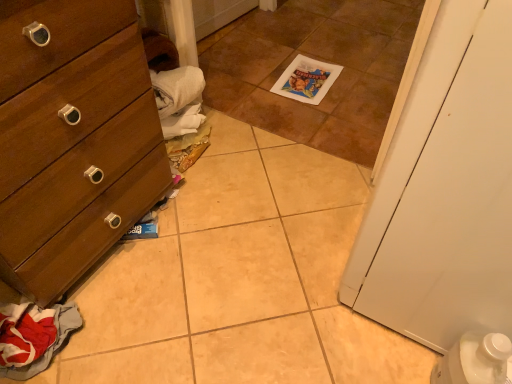
The height and width of the screenshot is (384, 512). Find the location of `red fabric clothes at lower left`. red fabric clothes at lower left is located at coordinates (52, 345).

What is the approximate width of wooden dresser at left?

It is 15.90 inches.

You are a GUI agent. You are given a task and a screenshot of the screen. Output one action in this format:
    pyautogui.click(x=<x>, y=<y>)
    Task: Click on the white matte door at right
    
    Given the screenshot: What is the action you would take?
    pyautogui.click(x=454, y=206)

Can you confirm if red fabric clothes at lower left is thinner than white matte door at right?

Yes, red fabric clothes at lower left is thinner than white matte door at right.

Could you tell me if red fabric clothes at lower left is facing white matte door at right?

No.

Looking at this image, would you say white matte door at right is part of red fabric clothes at lower left's contents?

Actually, white matte door at right is outside red fabric clothes at lower left.

Between red fabric clothes at lower left and white matte door at right, which one has larger size?

With larger size is white matte door at right.

Is white matte door at right to the left of brown tile at center from the viewer's perspective?

No, white matte door at right is not to the left of brown tile at center.

From a real-world perspective, is white matte door at right beneath brown tile at center?

No, from a real-world perspective, white matte door at right is not beneath brown tile at center.

Find the location of a particular element. tile on the left of white matte door at right is located at coordinates tap(317, 59).

Would you say white matte door at right is a long distance from brown tile at center?

Absolutely, white matte door at right is distant from brown tile at center.

Between white matte door at right and wooden dresser at left, which one has smaller size?

With smaller size is white matte door at right.

Is white matte door at right wider than wooden dresser at left?

Yes, white matte door at right is wider than wooden dresser at left.

Does white matte door at right turn towards wooden dresser at left?

Yes, white matte door at right is aimed at wooden dresser at left.

Looking at this image, do you think white matte door at right is within wooden dresser at left, or outside of it?

white matte door at right is spatially situated outside wooden dresser at left.

From the image's perspective, is wooden dresser at left over red fabric clothes at lower left?

Correct, wooden dresser at left appears higher than red fabric clothes at lower left in the image.

Is wooden dresser at left directly adjacent to red fabric clothes at lower left?

No, wooden dresser at left is not touching red fabric clothes at lower left.

Is wooden dresser at left oriented towards red fabric clothes at lower left?

No, wooden dresser at left is not oriented towards red fabric clothes at lower left.

Considering the points (26, 164) and (68, 318), which point is behind, point (26, 164) or point (68, 318)?

Point (68, 318)

Which object is positioned more to the left, brown tile at center or red fabric clothes at lower left?

red fabric clothes at lower left.

Is point (352, 11) positioned behind point (57, 317)?

Yes, point (352, 11) is behind point (57, 317).

Considering the sizes of objects brown tile at center and red fabric clothes at lower left in the image provided, who is taller, brown tile at center or red fabric clothes at lower left?

Standing taller between the two is red fabric clothes at lower left.

Is brown tile at center in front of or behind red fabric clothes at lower left in the image?

Visually, brown tile at center is located behind red fabric clothes at lower left.

Is the position of wooden dresser at left more distant than that of brown tile at center?

No, the depth of wooden dresser at left is less than that of brown tile at center.

How many degrees apart are the facing directions of wooden dresser at left and brown tile at center?

The angular difference between wooden dresser at left and brown tile at center is 179 degrees.

From a real-world perspective, is wooden dresser at left under brown tile at center?

No.

Can you confirm if wooden dresser at left is taller than brown tile at center?

Indeed, wooden dresser at left has a greater height compared to brown tile at center.

Between brown tile at center and white matte door at right, which one appears on the right side from the viewer's perspective?

white matte door at right is more to the right.

Consider the image. Is brown tile at center aimed at white matte door at right?

No, brown tile at center is not aimed at white matte door at right.

Where is `door in front of the brown tile at center`? door in front of the brown tile at center is located at coordinates (454, 206).

In terms of width, does brown tile at center look wider or thinner when compared to white matte door at right?

Considering their sizes, brown tile at center looks broader than white matte door at right.

The height and width of the screenshot is (384, 512). I want to click on door above the red fabric clothes at lower left (from a real-world perspective), so click(x=454, y=206).

This screenshot has height=384, width=512. I want to click on door below the brown tile at center (from the image's perspective), so click(x=454, y=206).

Which object lies further to the anchor point brown tile at center, red fabric clothes at lower left or wooden dresser at left?

red fabric clothes at lower left is further to brown tile at center.

Estimate the real-world distances between objects in this image. Which object is further from brown tile at center, wooden dresser at left or white matte door at right?

Based on the image, white matte door at right appears to be further to brown tile at center.

From the image, which object appears to be nearer to white matte door at right, red fabric clothes at lower left or brown tile at center?

red fabric clothes at lower left is closer to white matte door at right.

Looking at the image, which one is located closer to wooden dresser at left, red fabric clothes at lower left or brown tile at center?

red fabric clothes at lower left.

Based on their spatial positions, is brown tile at center or wooden dresser at left closer to white matte door at right?

wooden dresser at left is positioned closer to the anchor white matte door at right.

Based on their spatial positions, is white matte door at right or brown tile at center closer to red fabric clothes at lower left?

Among the two, white matte door at right is located nearer to red fabric clothes at lower left.

Considering their positions, is white matte door at right positioned further to wooden dresser at left than red fabric clothes at lower left?

Based on the image, white matte door at right appears to be further to wooden dresser at left.

Based on their spatial positions, is white matte door at right or red fabric clothes at lower left further from brown tile at center?

red fabric clothes at lower left lies further to brown tile at center than the other object.

Locate an element on the screen. This screenshot has width=512, height=384. tile situated between red fabric clothes at lower left and white matte door at right from left to right is located at coordinates (317, 59).

Image resolution: width=512 pixels, height=384 pixels. What are the coordinates of `chest of drawers between red fabric clothes at lower left and white matte door at right in the horizontal direction` in the screenshot? It's located at (73, 143).

Locate an element on the screen. chest of drawers between white matte door at right and brown tile at center from front to back is located at coordinates (73, 143).

You are a GUI agent. You are given a task and a screenshot of the screen. Output one action in this format:
    pyautogui.click(x=<x>, y=<y>)
    Task: Click on the chest of drawers located between red fabric clothes at lower left and brown tile at center in the left-right direction
    The height and width of the screenshot is (384, 512).
    Given the screenshot: What is the action you would take?
    pyautogui.click(x=73, y=143)